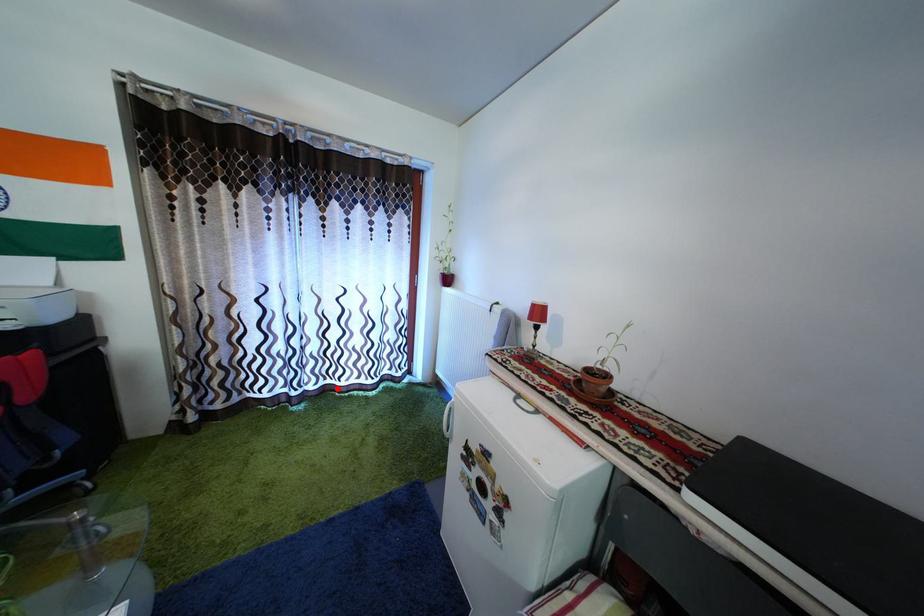
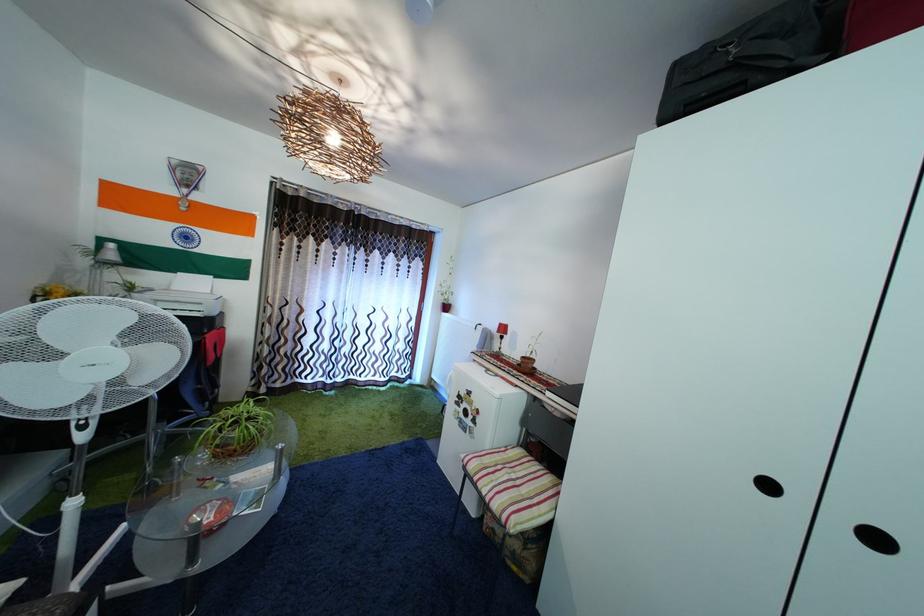
Find the pixel in the second image that matches the highlighted location in the first image.

(359, 384)